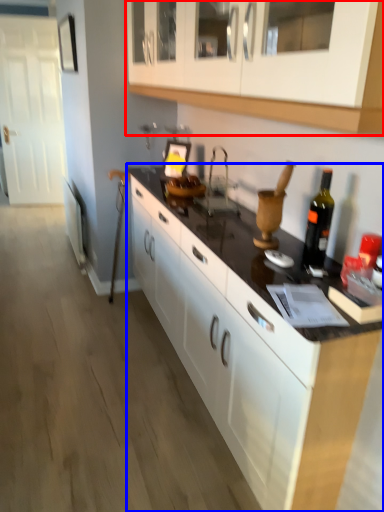
Question: Which object appears closest to the camera in this image, cabinetry (highlighted by a red box) or countertop (highlighted by a blue box)?

Choices:
 (A) cabinetry
 (B) countertop

Answer: (A)